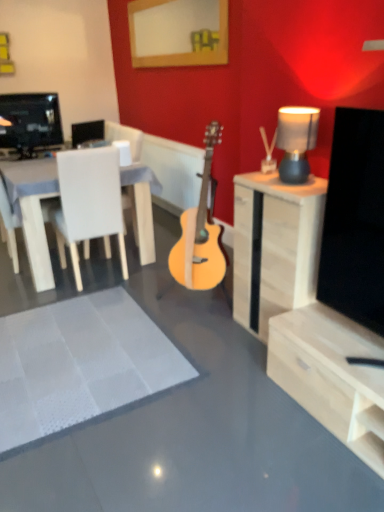
Identify the location of vacant space situated on the left part of matte gray lampshade at upper right. (265, 179).